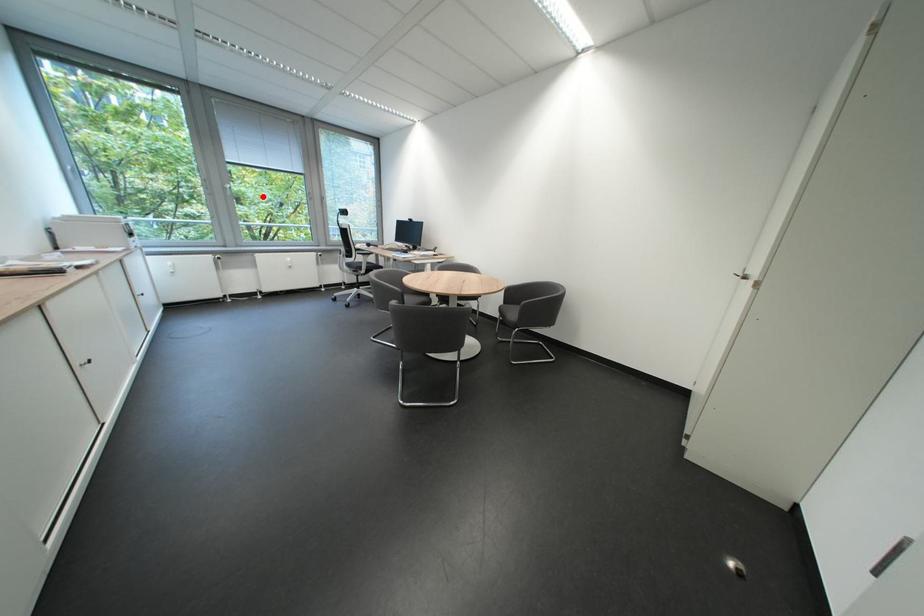
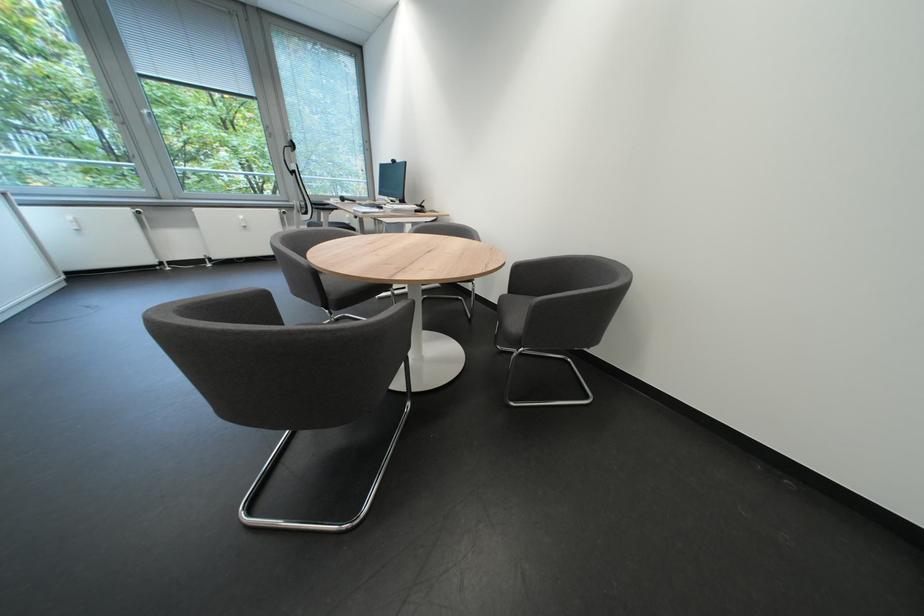
Locate, in the second image, the point that corresponds to the highlighted location in the first image.

(248, 146)